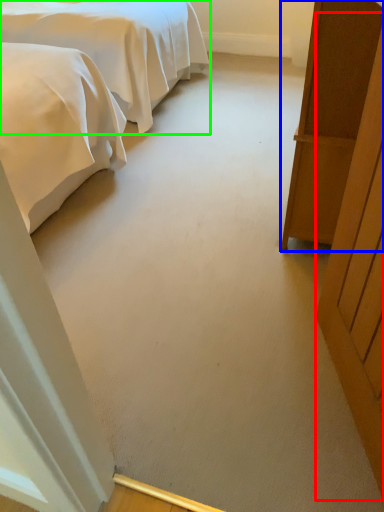
Question: Based on their relative distances, which object is nearer to door (highlighted by a red box)? Choose from furniture (highlighted by a blue box) and bed (highlighted by a green box).

Choices:
 (A) furniture
 (B) bed

Answer: (A)